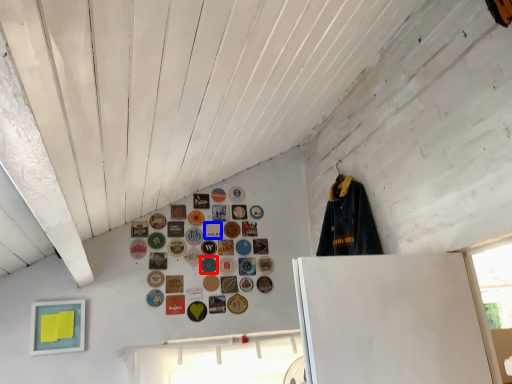
Question: Among these objects, which one is farthest to the camera, button (highlighted by a red box) or button (highlighted by a blue box)?

Choices:
 (A) button
 (B) button

Answer: (B)